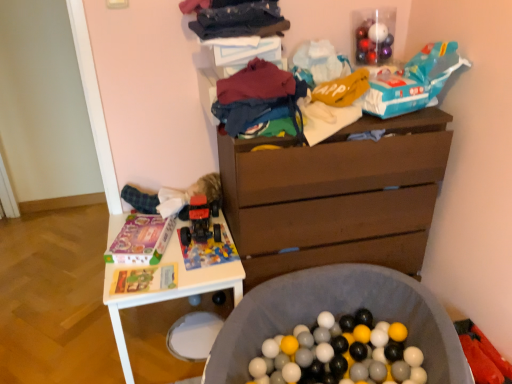
Identify the location of free space above dark blue fabric at upper center, the first clothing from the top (from a real-world perspective). The height and width of the screenshot is (384, 512). (237, 5).